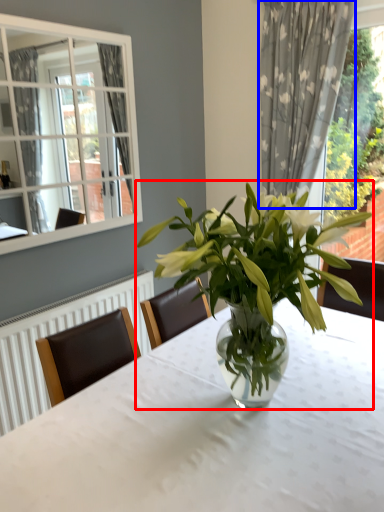
Question: Which object is further to the camera taking this photo, houseplant (highlighted by a red box) or curtain (highlighted by a blue box)?

Choices:
 (A) houseplant
 (B) curtain

Answer: (B)